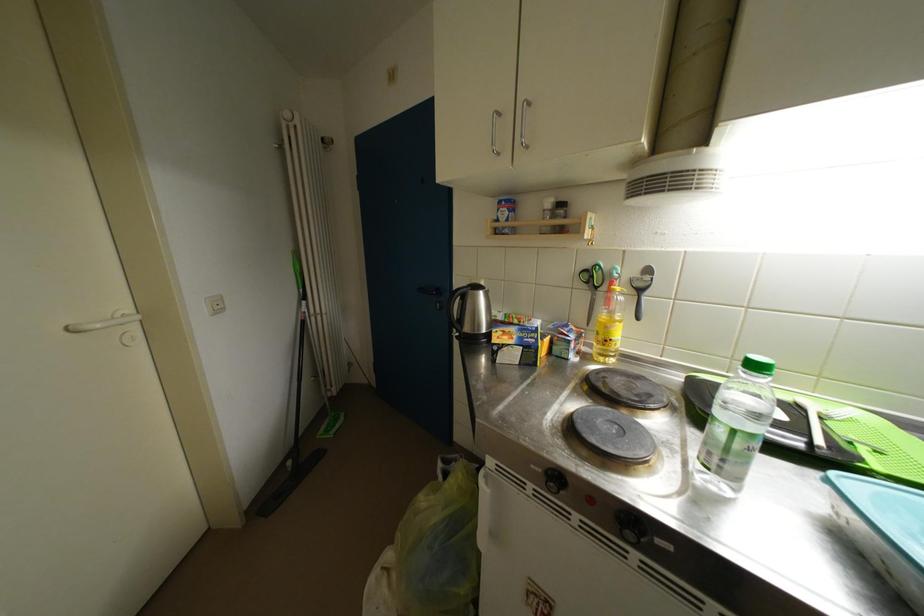
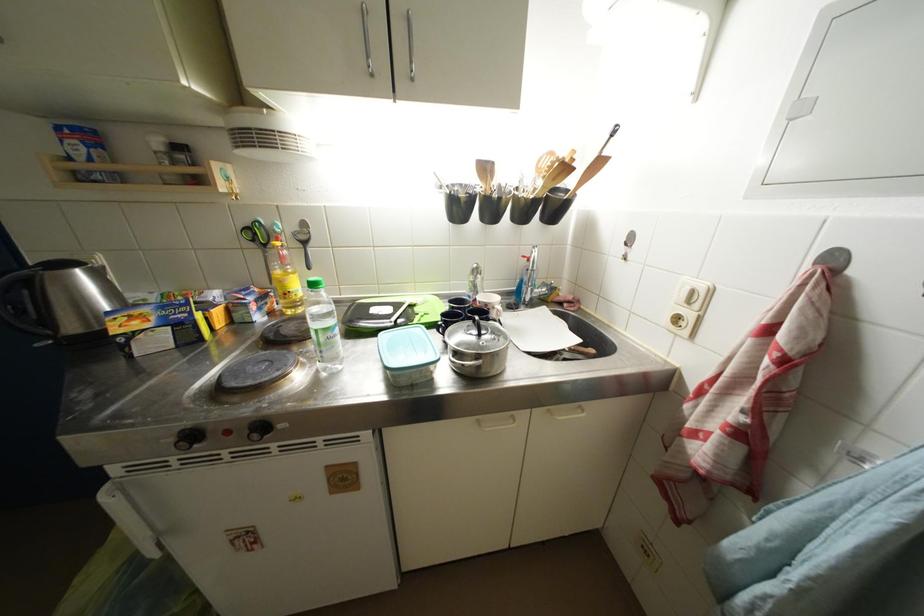
In the second image, find the point that corresponds to pixel 641 530 in the first image.

(269, 431)